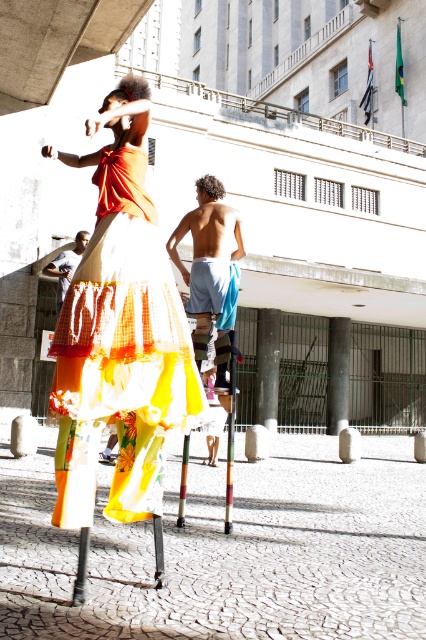
You are a photographer trying to capture the stilt walkers from the best angle. You notice two specific points in the image marked as point 1 at coordinates (164, 337) and point 2 at coordinates (66, 260). Which point is closer to the camera based on their positions?

Point 1 at coordinates (164, 337) is in front of point 2 at coordinates (66, 260), so it is closer to the camera.

You are a photographer standing at the camera position. You want to take a photo of the floral chiffon dress at center. If your camera has a minimum focus distance of 3 meters, will you be able to capture the dress clearly?

The floral chiffon dress at center is 3.41 meters away from the camera. Since the minimum focus distance is 3 meters, the camera can focus on the dress as it is beyond the minimum requirement. Therefore, you can capture the dress clearly.

You are a delivery drone that needs to deliver a package to the wooden pole at center. You are currently hovering above the matte blue shorts at lower left. Can you safely land the package without needing to move the shorts?

The wooden pole at center and matte blue shorts at lower left are 20.20 feet apart from each other. Since the distance is sufficient, the drone can safely land the package at the wooden pole at center without needing to move the matte blue shorts at lower left.